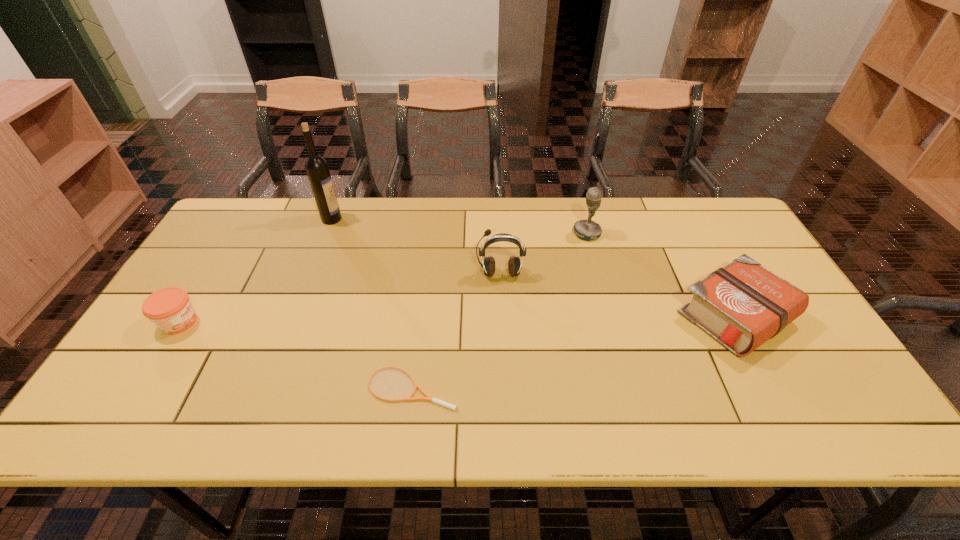
At what (x,y) coordinates should I click in order to perform the action: click on object located in the left edge section of the desktop. Please return your answer as a coordinate pair (x, y). Looking at the image, I should click on (170, 309).

The height and width of the screenshot is (540, 960). I want to click on object that is positioned at the right edge, so click(x=742, y=305).

In the image, there is a desktop. Identify the location of free space at the far edge. (541, 207).

The image size is (960, 540). In the image, there is a desktop. Find the location of `vacant area at the near edge`. vacant area at the near edge is located at coordinates (492, 407).

This screenshot has width=960, height=540. Find the location of `vacant space at the left edge of the desktop`. vacant space at the left edge of the desktop is located at coordinates (199, 285).

In the image, there is a desktop. At what (x,y) coordinates should I click in order to perform the action: click on vacant space at the right edge. Please return your answer as a coordinate pair (x, y). The width and height of the screenshot is (960, 540). Looking at the image, I should click on (718, 249).

This screenshot has height=540, width=960. In order to click on free spot at the far right corner of the desktop in this screenshot , I will do `click(676, 199)`.

Find the location of `free spot between the fifth object from left to right and the fourth object from left to right`. free spot between the fifth object from left to right and the fourth object from left to right is located at coordinates (543, 253).

Locate an element on the screen. The height and width of the screenshot is (540, 960). vacant region between the earphone and the fifth object from right to left is located at coordinates (416, 246).

Where is `free spot between the third object from right to left and the tennis racket`? This screenshot has height=540, width=960. free spot between the third object from right to left and the tennis racket is located at coordinates (456, 330).